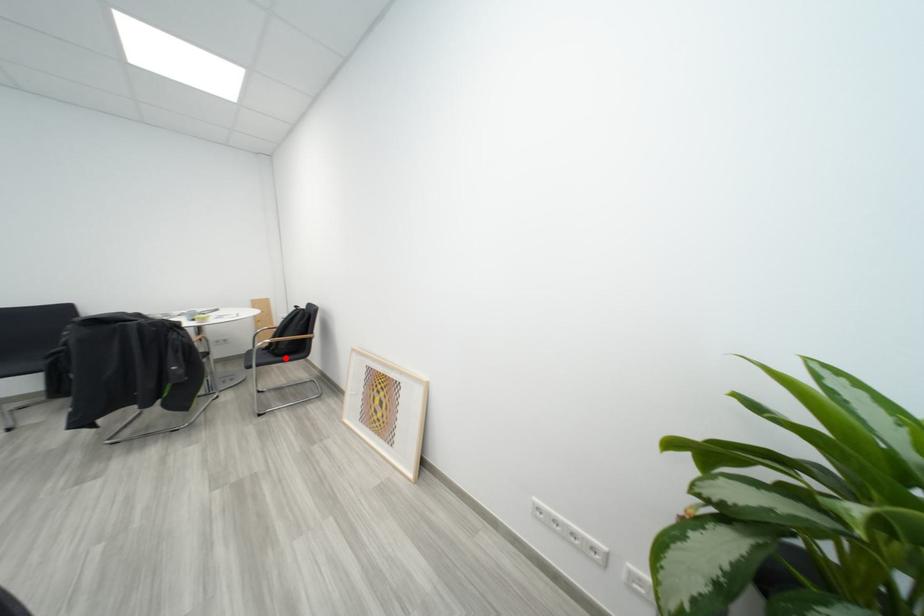
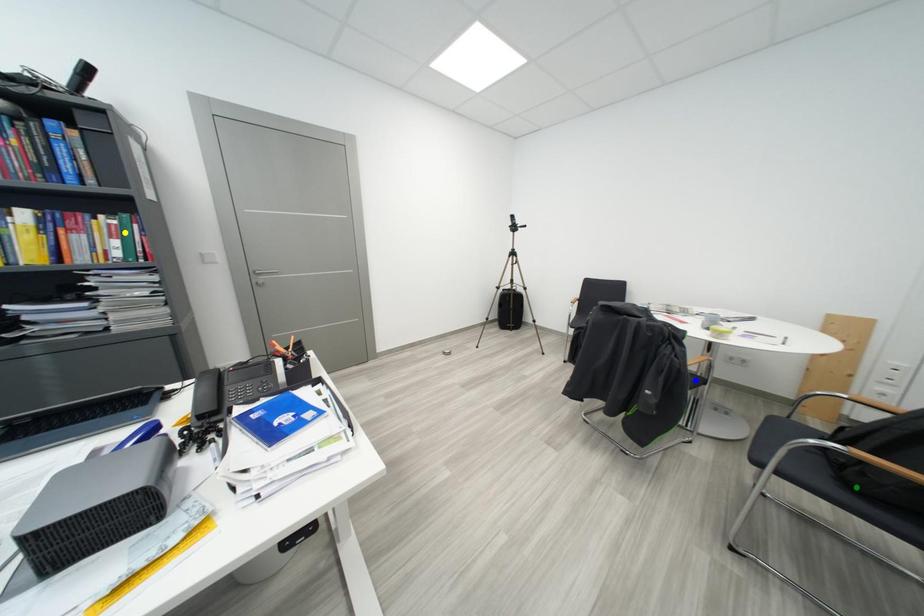
Question: I am providing you with two images of the same scene from different viewpoints. A red point is marked on the first image. You are given multiple points on the second image. Which point in image 2 represents the same 3d spot as the red point in image 1?

Choices:
 (A) blue point
 (B) green point
 (C) yellow point

Answer: (B)